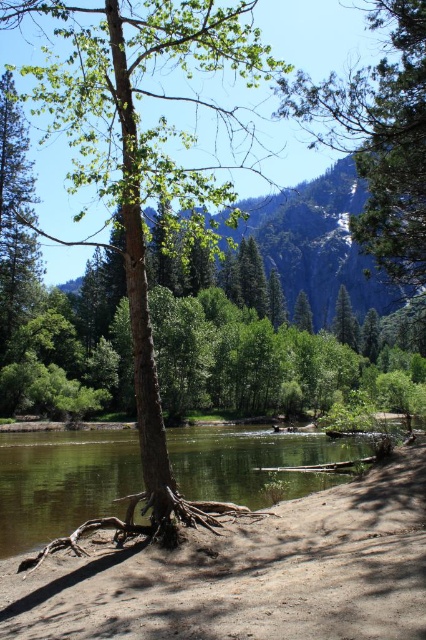
Question: Does brown rough bark tree at center have a lesser width compared to green rough bark tree at upper left?

Choices:
 (A) no
 (B) yes

Answer: (A)

Question: Which object is closer to the camera taking this photo?

Choices:
 (A) brown rough bark tree at center
 (B) brown rough tree roots at lower center
 (C) green rough bark tree at upper left
 (D) green textured pine tree at upper right

Answer: (B)

Question: Which of the following is the closest to the observer?

Choices:
 (A) green rough bark tree at upper left
 (B) green textured pine tree at upper right
 (C) brown rough tree roots at lower center
 (D) brown rough bark tree at center

Answer: (C)

Question: Can you confirm if clear water at lower center is positioned to the left of green rough bark tree at upper left?

Choices:
 (A) yes
 (B) no

Answer: (B)

Question: Which of these objects is positioned farthest from the clear water at lower center?

Choices:
 (A) green textured pine tree at upper right
 (B) brown rough bark tree at center
 (C) brown rough tree roots at lower center
 (D) green rough bark tree at upper left

Answer: (B)

Question: Does brown rough bark tree at center appear over green rough bark tree at upper left?

Choices:
 (A) no
 (B) yes

Answer: (B)